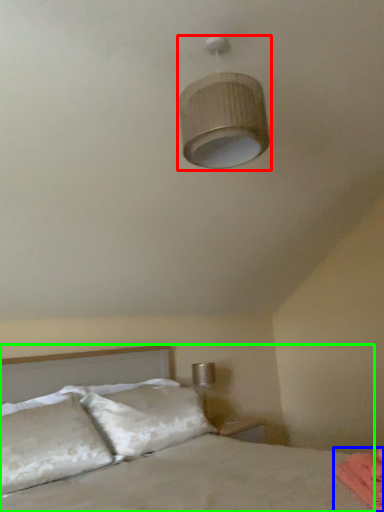
Question: Based on their relative distances, which object is nearer to lamp (highlighted by a red box)? Choose from sheet (highlighted by a blue box) and bed (highlighted by a green box).

Choices:
 (A) sheet
 (B) bed

Answer: (A)